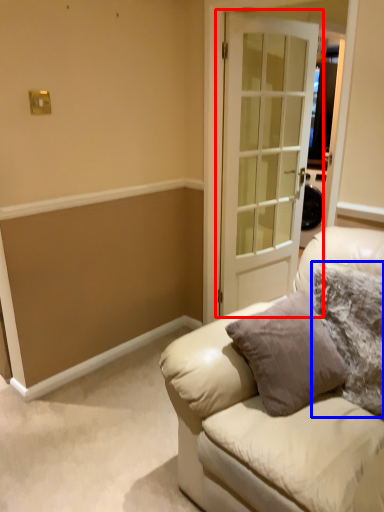
Question: Which of the following is the closest to the observer, door (highlighted by a red box) or pillow (highlighted by a blue box)?

Choices:
 (A) door
 (B) pillow

Answer: (B)